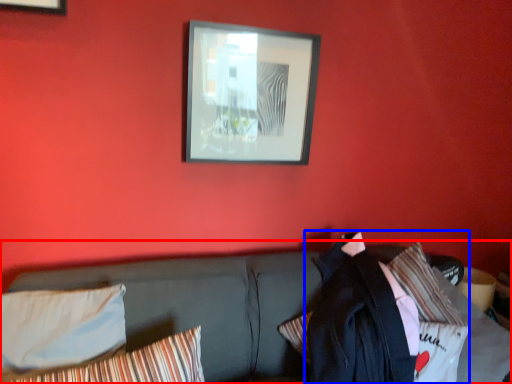
Question: Which object is further to the camera taking this photo, studio couch (highlighted by a red box) or jacket (highlighted by a blue box)?

Choices:
 (A) studio couch
 (B) jacket

Answer: (B)